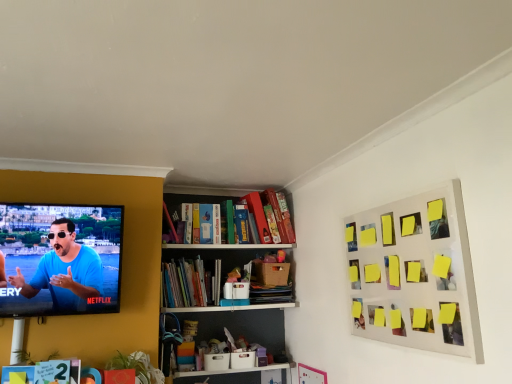
Question: From a real-world perspective, does hardcover book at lower left, which is the first book in bottom-to-top order, sit lower than matte blue shirt at left?

Choices:
 (A) no
 (B) yes

Answer: (B)

Question: Considering the relative sizes of hardcover book at lower left, marked as the second book in a back-to-front arrangement, and matte blue shirt at left in the image provided, is hardcover book at lower left, marked as the second book in a back-to-front arrangement, smaller than matte blue shirt at left?

Choices:
 (A) no
 (B) yes

Answer: (B)

Question: Is hardcover book at lower left, marked as the second book in a back-to-front arrangement, at the left side of matte blue shirt at left?

Choices:
 (A) yes
 (B) no

Answer: (A)

Question: From a real-world perspective, is hardcover book at lower left, the 2th book when ordered from top to bottom, positioned over matte blue shirt at left based on gravity?

Choices:
 (A) no
 (B) yes

Answer: (A)

Question: Would you consider hardcover book at lower left, which ranks as the 2th book in right-to-left order, to be distant from matte blue shirt at left?

Choices:
 (A) yes
 (B) no

Answer: (B)

Question: Choose the correct answer: Is hardcover book at lower left, the first book in the front-to-back sequence, inside matte blue shirt at left or outside it?

Choices:
 (A) inside
 (B) outside

Answer: (B)

Question: From a real-world perspective, is hardcover book at lower left, marked as the second book in a back-to-front arrangement, positioned above or below matte blue shirt at left?

Choices:
 (A) below
 (B) above

Answer: (A)

Question: In terms of size, does hardcover book at lower left, the 2th book when ordered from top to bottom, appear bigger or smaller than matte blue shirt at left?

Choices:
 (A) big
 (B) small

Answer: (B)

Question: Looking at their shapes, would you say hardcover book at lower left, which is the first book in bottom-to-top order, is wider or thinner than matte blue shirt at left?

Choices:
 (A) thin
 (B) wide

Answer: (A)

Question: Would you say matte blue shirt at left is inside or outside yellow sticky notes at upper right?

Choices:
 (A) outside
 (B) inside

Answer: (A)

Question: In the image, is matte blue shirt at left positioned in front of or behind yellow sticky notes at upper right?

Choices:
 (A) front
 (B) behind

Answer: (B)

Question: From a real-world perspective, is matte blue shirt at left physically located above or below yellow sticky notes at upper right?

Choices:
 (A) above
 (B) below

Answer: (A)

Question: Is matte blue shirt at left bigger or smaller than yellow sticky notes at upper right?

Choices:
 (A) big
 (B) small

Answer: (A)

Question: From a real-world perspective, is yellow sticky notes at upper right above or below hardcover book at lower left, which is the first book in bottom-to-top order?

Choices:
 (A) above
 (B) below

Answer: (A)

Question: Is yellow sticky notes at upper right spatially inside hardcover book at lower left, marked as the second book in a back-to-front arrangement, or outside of it?

Choices:
 (A) outside
 (B) inside

Answer: (A)